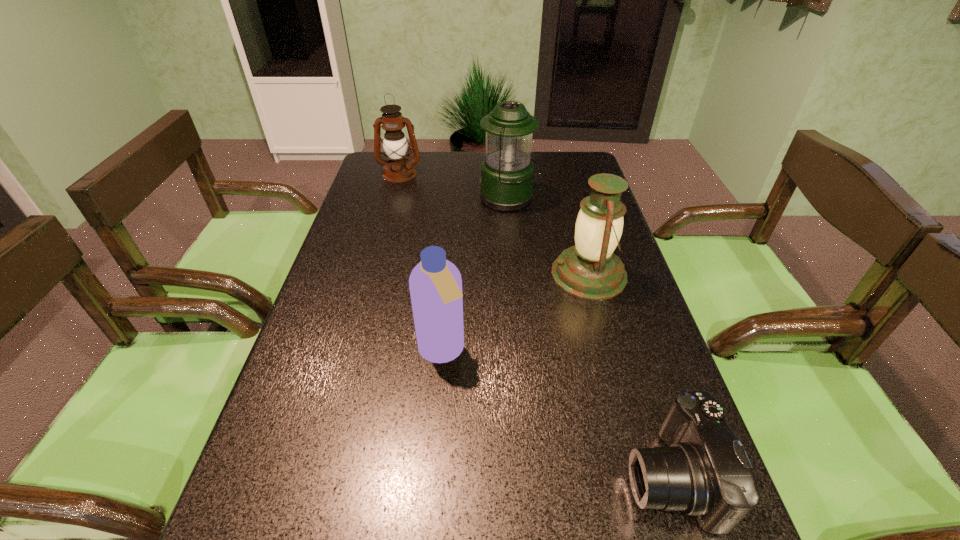
You are a GUI agent. You are given a task and a screenshot of the screen. Output one action in this format:
    pyautogui.click(x=<x>, y=<y>)
    Task: Click on the second nearest lantern
    The image size is (960, 540).
    Given the screenshot: What is the action you would take?
    pyautogui.click(x=507, y=173)

Image resolution: width=960 pixels, height=540 pixels. I want to click on the leftmost object, so click(x=398, y=169).

Identify the location of the farthest object. This screenshot has height=540, width=960. tap(398, 169).

Locate an element on the screen. the third farthest object is located at coordinates (590, 270).

This screenshot has width=960, height=540. Find the location of `the fourth farthest object`. the fourth farthest object is located at coordinates (435, 284).

The image size is (960, 540). I want to click on shampoo, so click(x=435, y=284).

You are a GUI agent. You are given a task and a screenshot of the screen. Output one action in this format:
    pyautogui.click(x=<x>, y=<y>)
    Task: Click on the camera
    Image resolution: width=960 pixels, height=540 pixels.
    Given the screenshot: What is the action you would take?
    pyautogui.click(x=705, y=472)

This screenshot has width=960, height=540. Identify the location of the nearest object. (705, 472).

At what (x,y) coordinates should I click in order to perform the action: click on vacant space situated 0.100m on the left of the fourth nearest object. Please return your answer as a coordinate pair (x, y). The height and width of the screenshot is (540, 960). Looking at the image, I should click on (448, 199).

Identify the location of vacant point located on the side of the leftmost object, there is a wick adjustment knob. This screenshot has height=540, width=960. (388, 219).